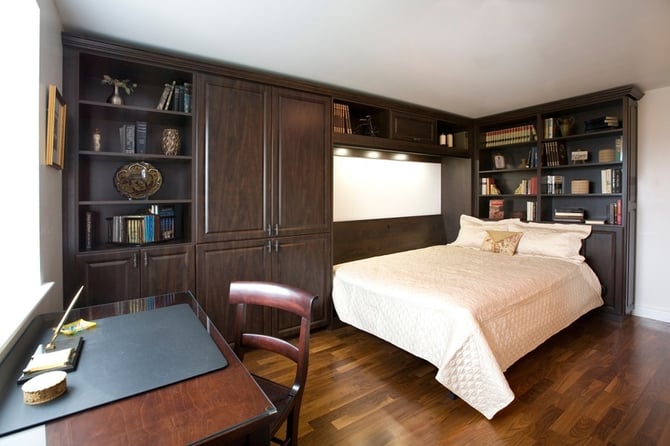
This screenshot has height=446, width=670. I want to click on hardwood floor, so coord(384,398).